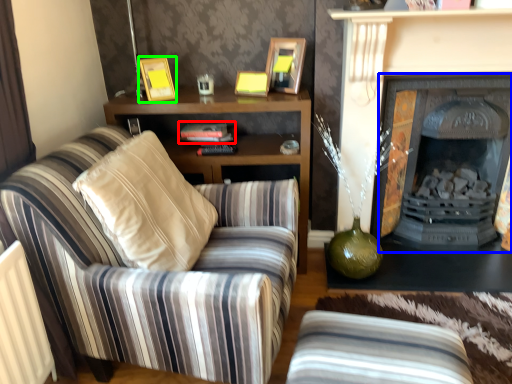
Question: Which object is positioned farthest from book (highlighted by a red box)? Select from fireplace (highlighted by a blue box) and picture frame (highlighted by a green box).

Choices:
 (A) fireplace
 (B) picture frame

Answer: (A)